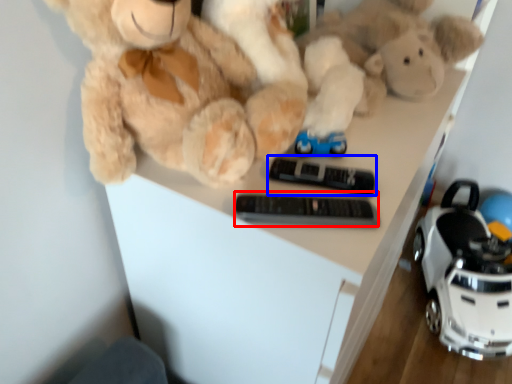
Question: Which object appears farthest to the camera in this image, control (highlighted by a red box) or control (highlighted by a blue box)?

Choices:
 (A) control
 (B) control

Answer: (B)